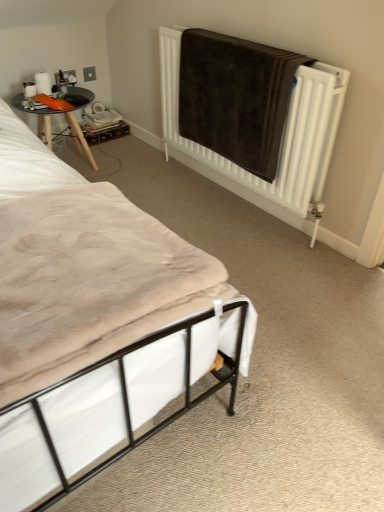
What are the coordinates of `blank space to the left of brown towel at upper right` in the screenshot? It's located at (161, 190).